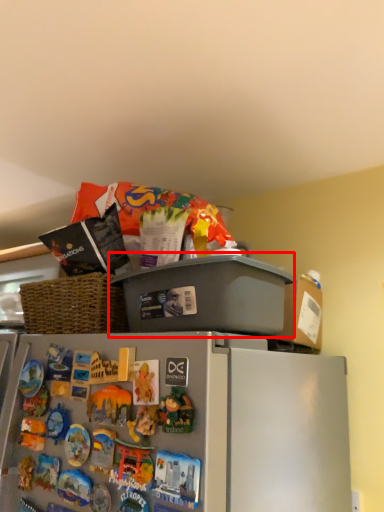
Question: Where is appliance (annotated by the red box) located in relation to toy in the image?

Choices:
 (A) right
 (B) left

Answer: (A)